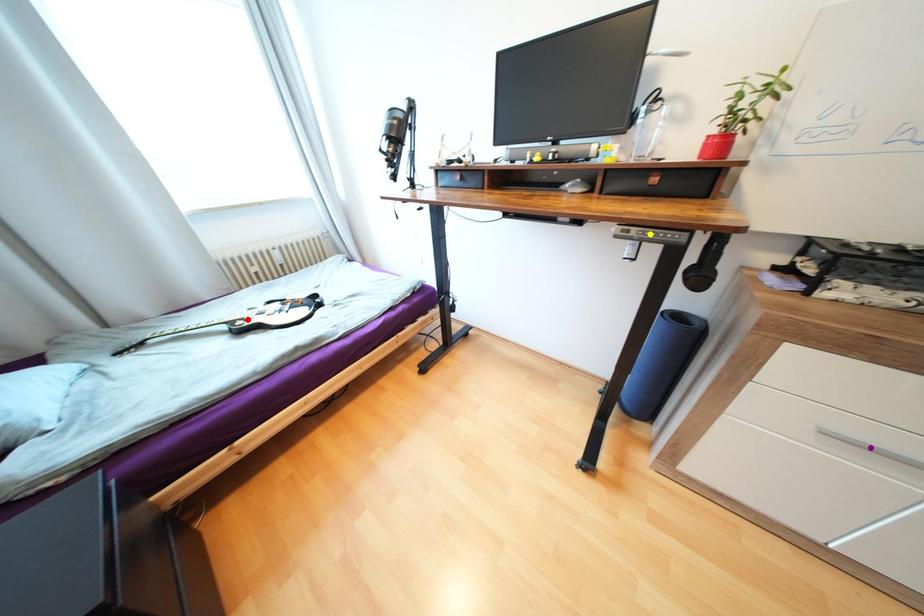
Order these from nearest to farthest:
1. yellow point
2. red point
3. purple point

purple point, yellow point, red point